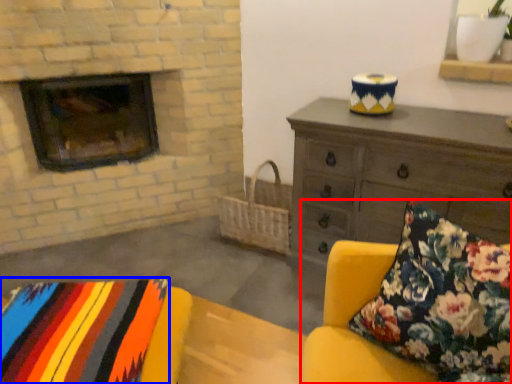
Question: Which object is closer to the camera taking this photo, studio couch (highlighted by a red box) or blanket (highlighted by a blue box)?

Choices:
 (A) studio couch
 (B) blanket

Answer: (A)